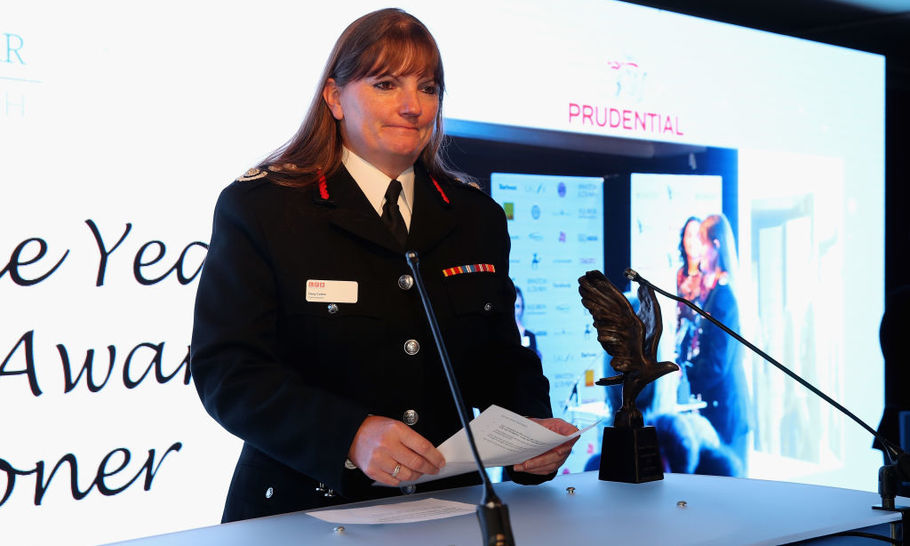
The width and height of the screenshot is (910, 546). Identify the location of 2 stands on table with microphones. (451, 391), (840, 406).